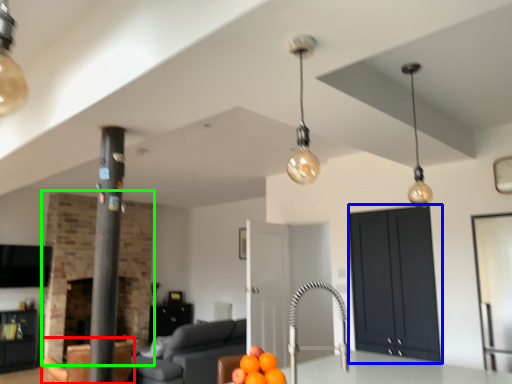
Question: Based on their relative distances, which object is farther from armchair (highlighted by a red box)? Choose from cabinetry (highlighted by a blue box) and fireplace (highlighted by a green box).

Choices:
 (A) cabinetry
 (B) fireplace

Answer: (A)